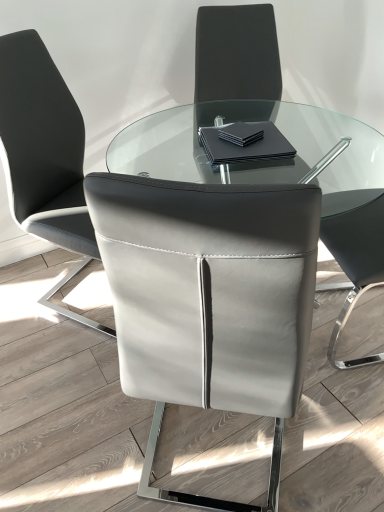
Question: Does point (18, 218) appear closer or farther from the camera than point (263, 122)?

Choices:
 (A) farther
 (B) closer

Answer: (A)

Question: From a real-world perspective, is white leather chair at center, marked as the 2th chair in a right-to-left arrangement, above or below black matte napkin at center?

Choices:
 (A) below
 (B) above

Answer: (A)

Question: Estimate the real-world distances between objects in this image. Which object is closer to the black matte napkin at center?

Choices:
 (A) white leather chair at center, marked as the 2th chair in a right-to-left arrangement
 (B) matte gray leather chair at center, the 2th chair when ordered from left to right

Answer: (A)

Question: Based on their relative distances, which object is nearer to the matte gray leather chair at center, which is counted as the 1th chair, starting from the right?

Choices:
 (A) white leather chair at center, marked as the 2th chair in a right-to-left arrangement
 (B) black matte napkin at center

Answer: (B)